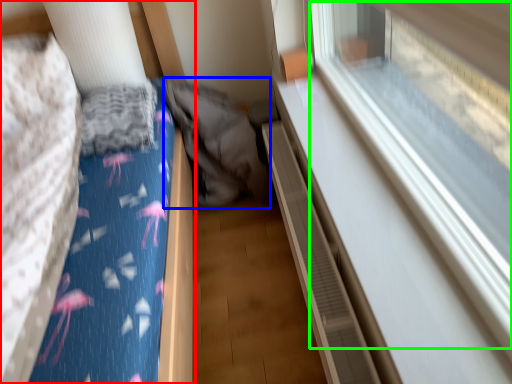
Question: Which is nearer to the furniture (highlighted by a red box)? sleeping bag (highlighted by a blue box) or train window (highlighted by a green box).

Choices:
 (A) sleeping bag
 (B) train window

Answer: (A)